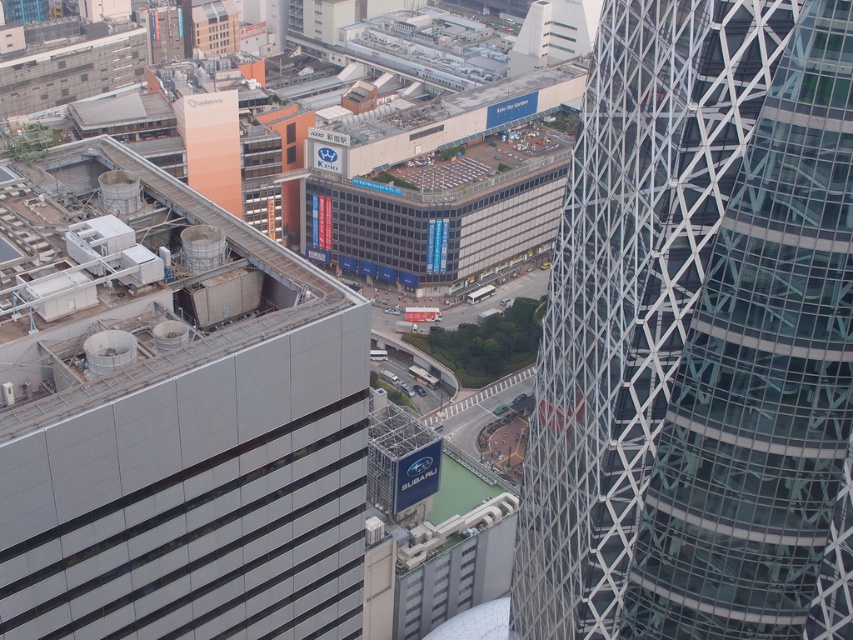
Question: Which object appears farthest from the camera in this image?

Choices:
 (A) metallic gray building at left
 (B) glassy steel tower at right

Answer: (A)

Question: Where is glassy steel tower at right located in relation to metallic gray building at left in the image?

Choices:
 (A) above
 (B) below

Answer: (B)

Question: Is glassy steel tower at right bigger than metallic gray building at left?

Choices:
 (A) no
 (B) yes

Answer: (A)

Question: Can you confirm if glassy steel tower at right is smaller than metallic gray building at left?

Choices:
 (A) no
 (B) yes

Answer: (B)

Question: Which of the following is the farthest from the observer?

Choices:
 (A) (73, 188)
 (B) (788, 506)

Answer: (A)